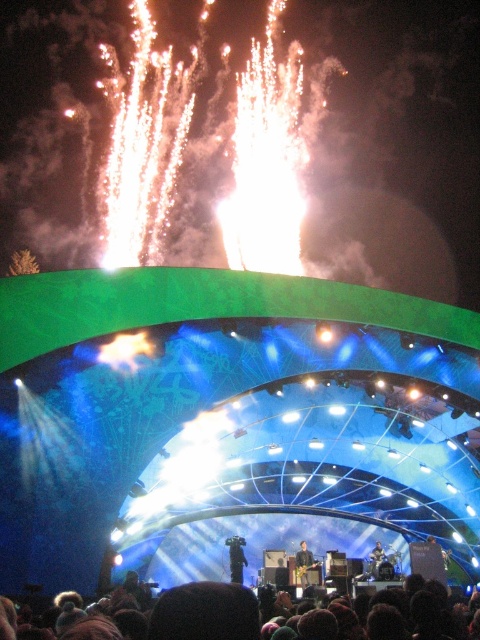
You are standing at the center of the stage and want to move towards the point labeled as point (x=238, y=580). However, there is an obstacle at point (x=371, y=572). Will you be able to reach your destination without going around the obstacle?

Since point (x=238, y=580) is in front of point (x=371, y=572), you can reach point (x=238, y=580) without going around the obstacle at point (x=371, y=572) because it is closer to you.

You are a photographer capturing the live music performance. You notice the brown hair at lower center and the smooth skin person at center. Which object is positioned higher in the image?

The brown hair at lower center is located above the smooth skin person at center, so it is positioned higher in the image.

You are a drone operator trying to capture the live music performance. Your drone is currently at a height of 80 meters. You want to fly it to the point at coordinates point (235, 545). Can your drone reach that point without exceeding its maximum altitude?

The distance of point (235, 545) from viewer is 83.77 meters. Since the drone is at 80 meters, it cannot reach the point as it would need to ascend beyond its current altitude to 83.77 meters.